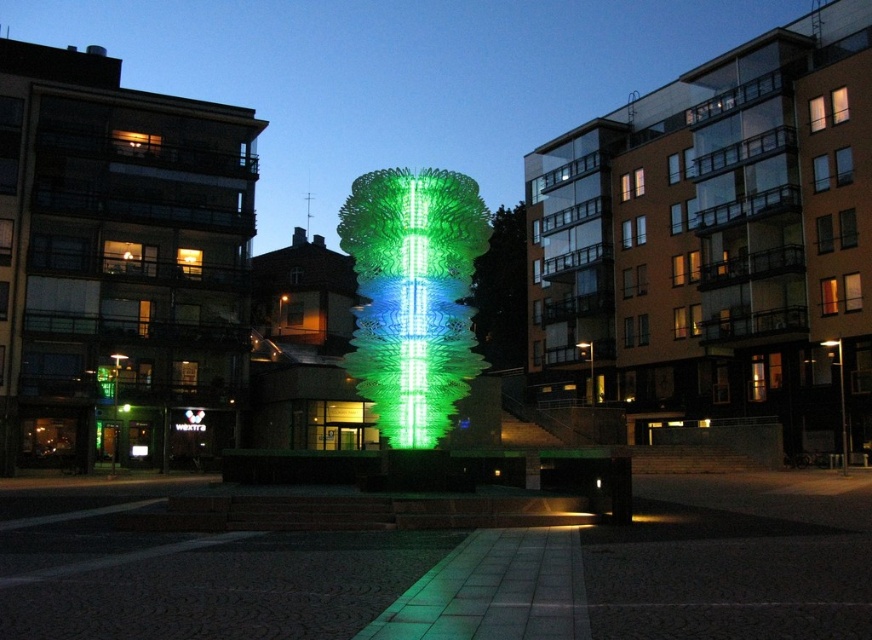
Based on the photo, does green translucent sculpture at center come in front of green textured tree at center?

Yes.

Between green translucent sculpture at center and green textured tree at center, which one appears on the right side from the viewer's perspective?

green textured tree at center is more to the right.

Locate an element on the screen. This screenshot has height=640, width=872. green translucent sculpture at center is located at coordinates (413, 296).